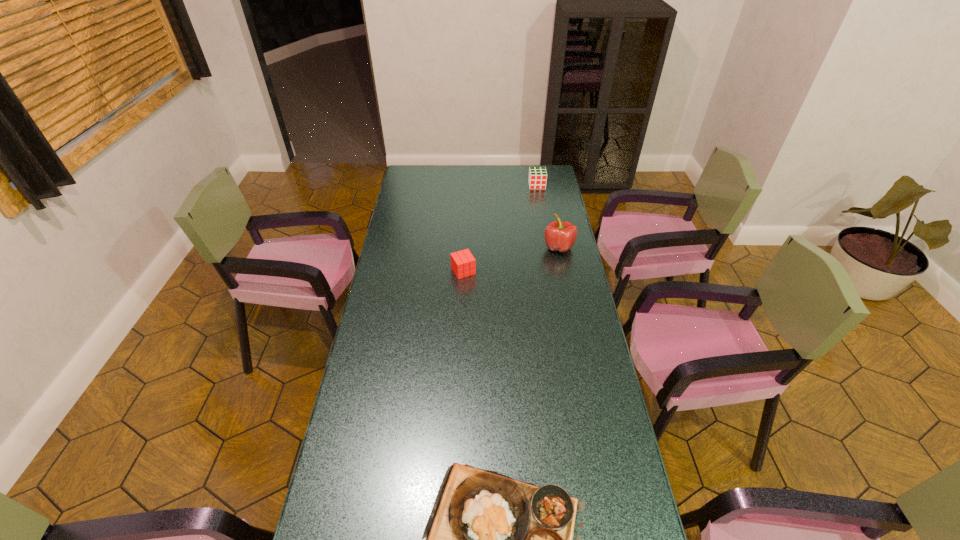
At what (x,y) coordinates should I click in order to perform the action: click on pepper that is positioned at the right edge. Please return your answer as a coordinate pair (x, y). The width and height of the screenshot is (960, 540). Looking at the image, I should click on (560, 236).

Where is `cube that is at the right edge`? This screenshot has width=960, height=540. cube that is at the right edge is located at coordinates (537, 179).

You are a GUI agent. You are given a task and a screenshot of the screen. Output one action in this format:
    pyautogui.click(x=<x>, y=<y>)
    Task: Click on the object present at the far right corner
    The width and height of the screenshot is (960, 540).
    Given the screenshot: What is the action you would take?
    pyautogui.click(x=537, y=179)

I want to click on free spot at the far edge of the desktop, so pos(487,167).

In the image, there is a desktop. In order to click on vacant space at the left edge in this screenshot , I will do `click(394, 410)`.

The height and width of the screenshot is (540, 960). What are the coordinates of `free location at the right edge of the desktop` in the screenshot? It's located at (577, 395).

Where is `vacant area between the farthest object and the nearer cube`? Image resolution: width=960 pixels, height=540 pixels. vacant area between the farthest object and the nearer cube is located at coordinates (500, 228).

Locate an element on the screen. This screenshot has width=960, height=540. empty space that is in between the farthest object and the pepper is located at coordinates (548, 216).

Identify the location of free space between the left cube and the farther cube. Image resolution: width=960 pixels, height=540 pixels. (500, 228).

Identify the location of vacant area that lies between the right cube and the tallest object. The height and width of the screenshot is (540, 960). (548, 216).